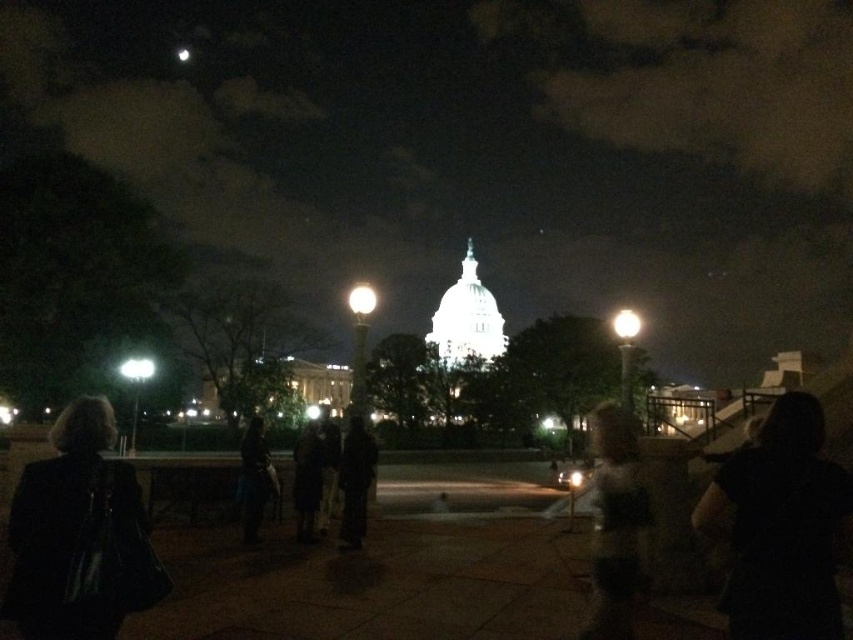
You are a photographer trying to capture a detailed shot of the black fabric coat at center and the dark fabric coat at center. Since the scene is lit by street lamps, which coat might be better illuminated? Please explain based on their positions.

The black fabric coat at center is located below the dark fabric coat at center. Since it is positioned lower, it might be closer to the ground where the light from the street lamps could cast shadows or create darker areas, potentially making the dark fabric coat at center appear better illuminated.

You are standing at the point marked by the coordinates point (79,536) in the image. Looking around, you see the dark gray leather jacket at lower left and the United States Capitol Building in the background. Which object is closer to you?

The dark gray leather jacket at lower left is closer to you because it is located at the lower left, which is part of the foreground, while the United States Capitol Building is in the background.

You are standing at the point marked by the coordinates point (780, 525) in the image. What is the object directly beneath your feet?

The point (780, 525) marks black fabric at center, so the object directly beneath your feet is the black fabric at center.